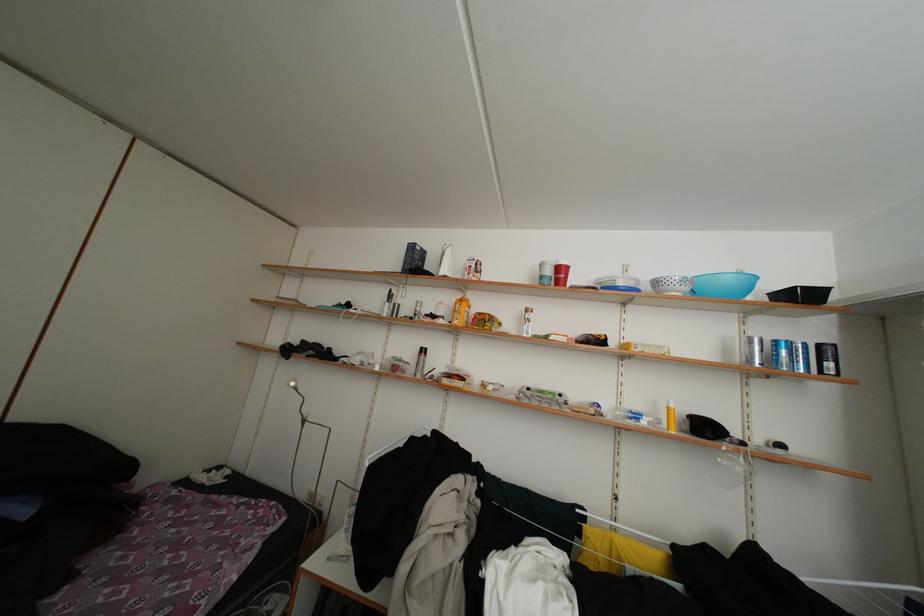
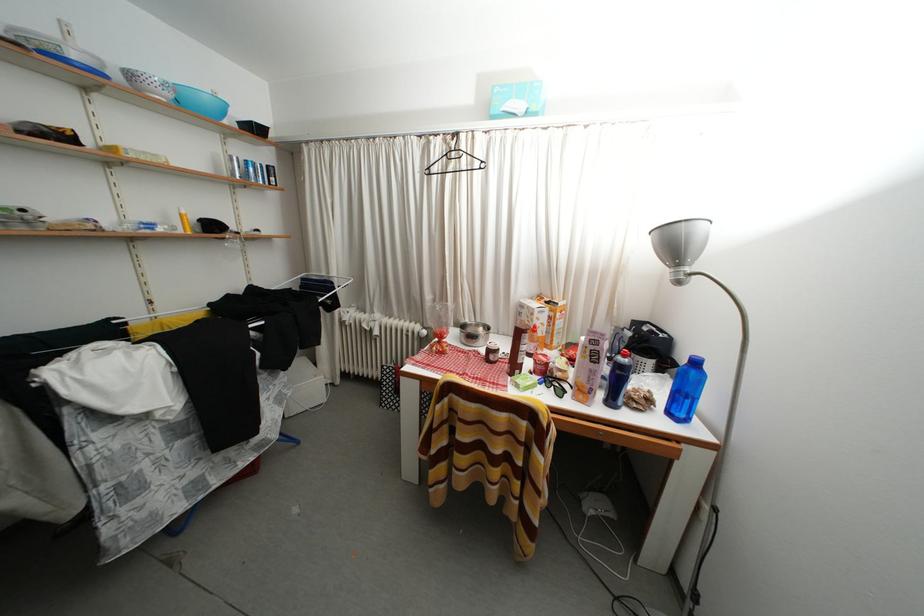
The point at (x=695, y=294) is marked in the first image. Where is the corresponding point in the second image?

(178, 100)